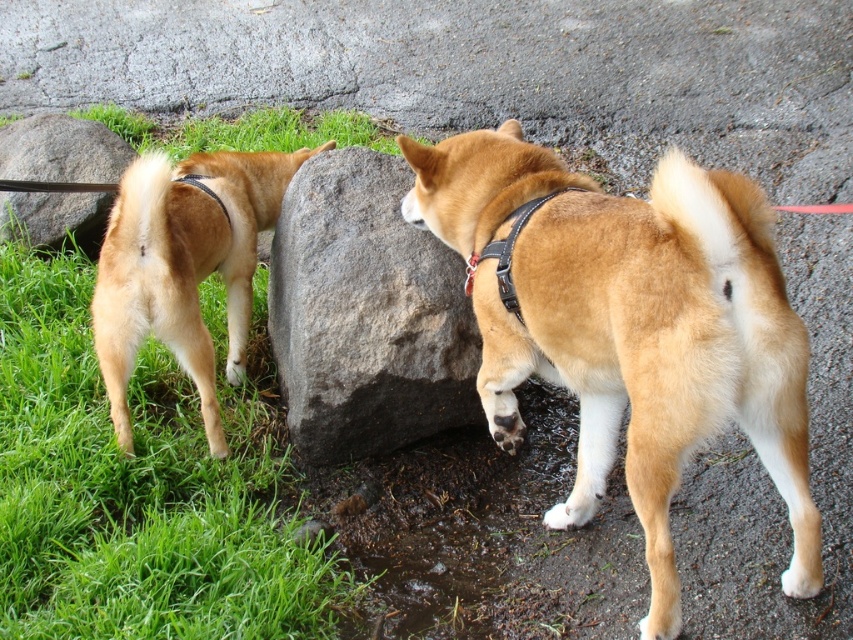
You are a dog owner who wants to ensure your dog doesn not trip over an object while walking. You see the gray rock at center and the black leather neckband at center in the scene. Which object is farther away from the other?

The gray rock at center and the black leather neckband at center are 9.35 feet apart, so they are both at a distance from each other. However, the question asks which is farther away from the other, but distance is mutual. If the owner is at a specific point, the answer depends on the owner s position. Since the scene doesn t specify the owner s location, we can state their separation distance as 9.35 feet.

You are a photographer trying to capture both the gray rough rock at center and the golden fur dog at left in the same frame. Which object should you focus on first to ensure both are in focus?

You should focus on the gray rough rock at center first because it is closer to you than the golden fur dog at left, so focusing on the closer object will help ensure both are in focus.